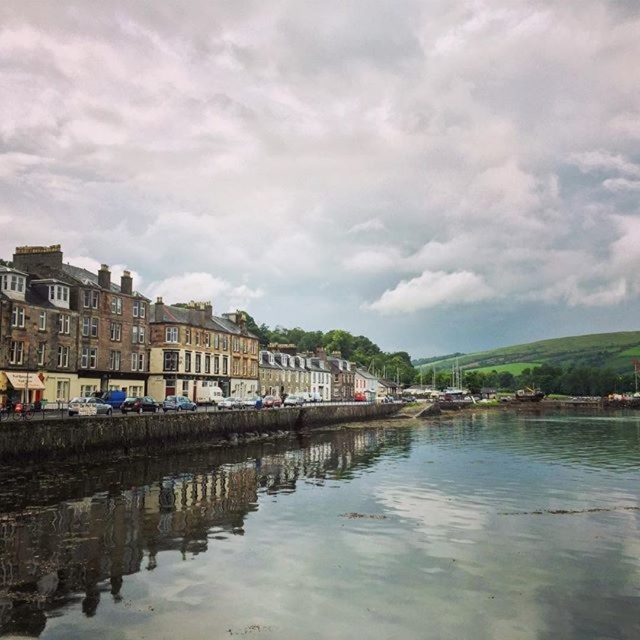
Question: Among these points, which one is nearest to the camera?

Choices:
 (A) (358, 340)
 (B) (588, 611)
 (C) (76, 404)

Answer: (B)

Question: Which of these objects is positioned closest to the clear water at center?

Choices:
 (A) silver metallic car at center
 (B) matte stone buildings at center

Answer: (A)

Question: In this image, where is clear water at center located relative to matte stone buildings at center?

Choices:
 (A) right
 (B) left

Answer: (A)

Question: Which of the following is the closest to the observer?

Choices:
 (A) (84, 404)
 (B) (372, 374)

Answer: (A)

Question: Does clear water at center appear under matte stone buildings at center?

Choices:
 (A) yes
 (B) no

Answer: (A)

Question: Does clear water at center have a larger size compared to matte stone buildings at center?

Choices:
 (A) no
 (B) yes

Answer: (A)